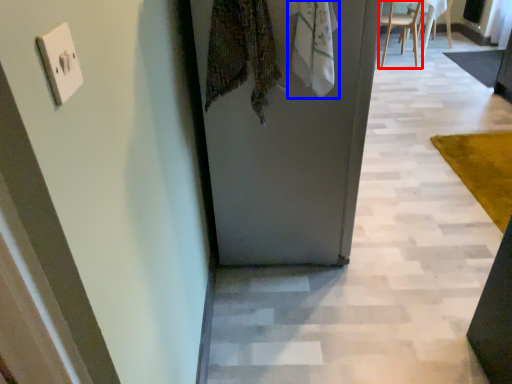
Question: Which object appears closest to the camera in this image, chair (highlighted by a red box) or scarf (highlighted by a blue box)?

Choices:
 (A) chair
 (B) scarf

Answer: (B)